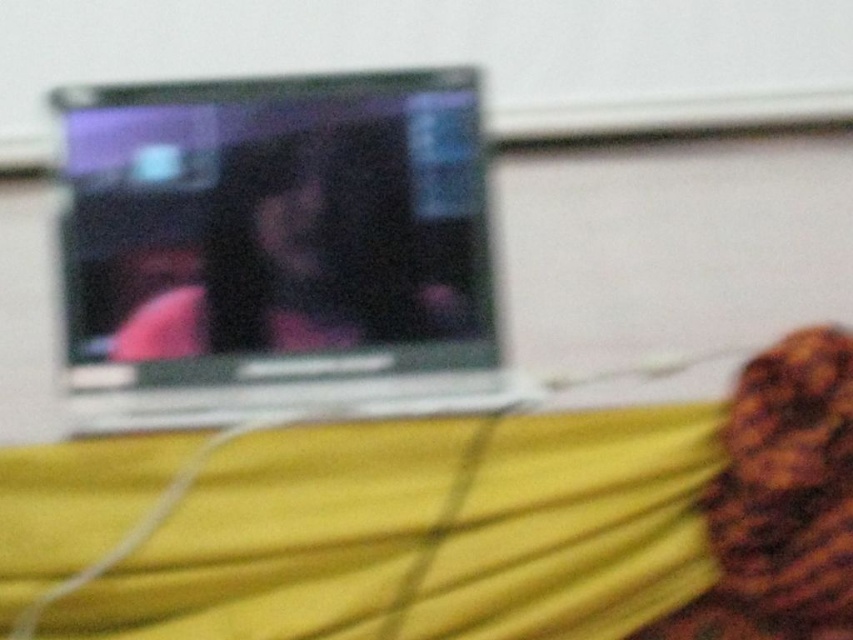
In the scene shown: Does yellow fabric at lower center appear under silver metallic laptop at upper center?

Yes, yellow fabric at lower center is below silver metallic laptop at upper center.

Is yellow fabric at lower center positioned at the back of silver metallic laptop at upper center?

That is False.

You are a GUI agent. You are given a task and a screenshot of the screen. Output one action in this format:
    pyautogui.click(x=<x>, y=<y>)
    Task: Click on the yellow fabric at lower center
    The image size is (853, 640).
    Given the screenshot: What is the action you would take?
    pyautogui.click(x=364, y=529)